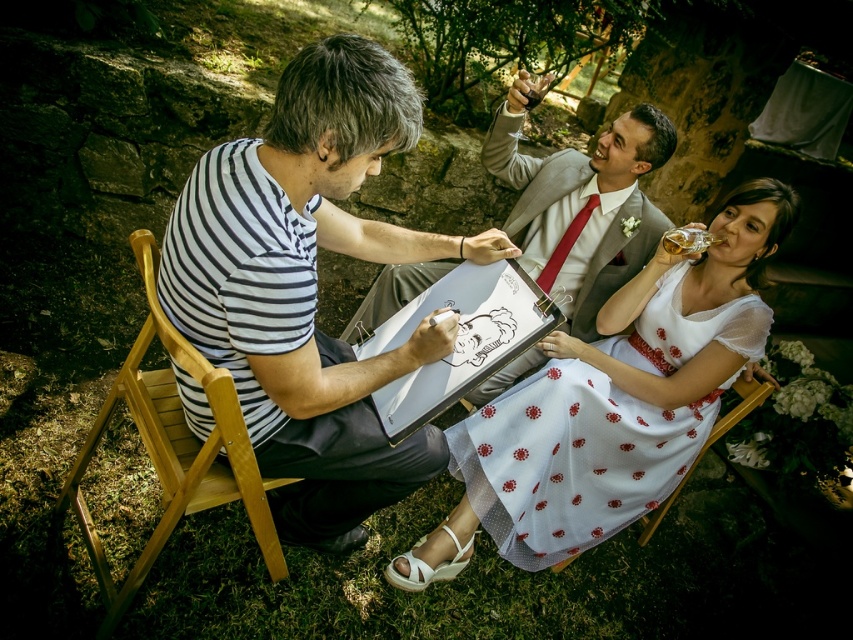
Does white dotted fabric dress at lower right have a lesser height compared to wooden chair at left?

No.

Who is shorter, white dotted fabric dress at lower right or wooden chair at left?

wooden chair at left is shorter.

Where is `white dotted fabric dress at lower right`? The width and height of the screenshot is (853, 640). white dotted fabric dress at lower right is located at coordinates (596, 432).

Can you confirm if striped cotton shirt at center is positioned to the left of wooden chair at left?

In fact, striped cotton shirt at center is to the right of wooden chair at left.

Consider the image. Does striped cotton shirt at center appear on the right side of wooden chair at left?

Indeed, striped cotton shirt at center is positioned on the right side of wooden chair at left.

Is point (184, 250) positioned after point (91, 440)?

No, it is in front of (91, 440).

The width and height of the screenshot is (853, 640). I want to click on striped cotton shirt at center, so click(x=310, y=288).

Which is above, striped cotton shirt at center or wooden chair at lower center?

striped cotton shirt at center is higher up.

Is striped cotton shirt at center to the left of wooden chair at lower center from the viewer's perspective?

Indeed, striped cotton shirt at center is positioned on the left side of wooden chair at lower center.

Describe the element at coordinates (310, 288) in the screenshot. I see `striped cotton shirt at center` at that location.

Image resolution: width=853 pixels, height=640 pixels. Identify the location of striped cotton shirt at center. (310, 288).